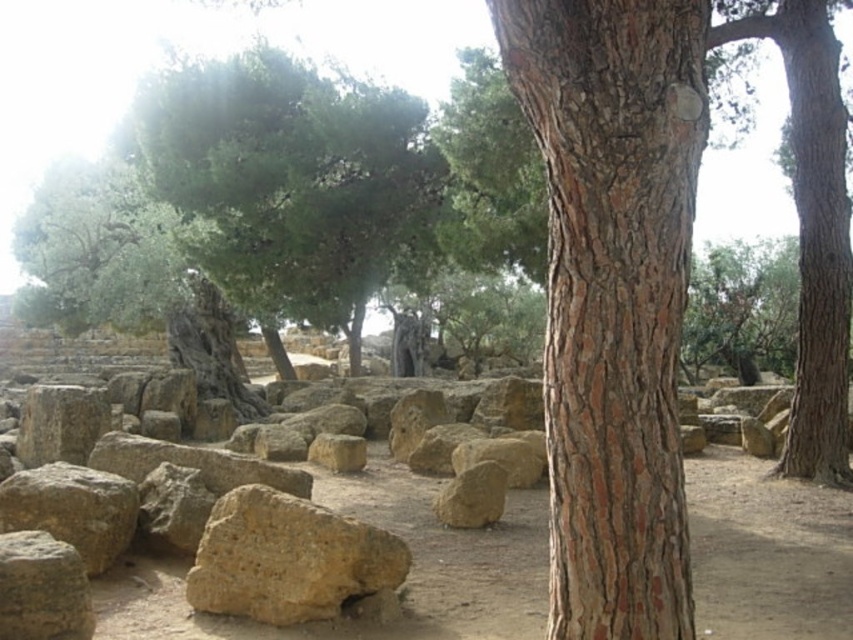
You are standing at the origin point in the scene. Can you tell me the coordinates of the brown dirt field at center?

The coordinates of the brown dirt field at center are at point (x=405, y=579).

You are standing in front of the ancient ruins surrounded by trees and stones. There are two points marked in the scene, one at coordinates point [648,161] and another at point [25,592]. Which point is nearer to your current position?

Point [648,161] is closer to the camera than point [25,592], so the point at coordinates point [648,161] is nearer to your current position.